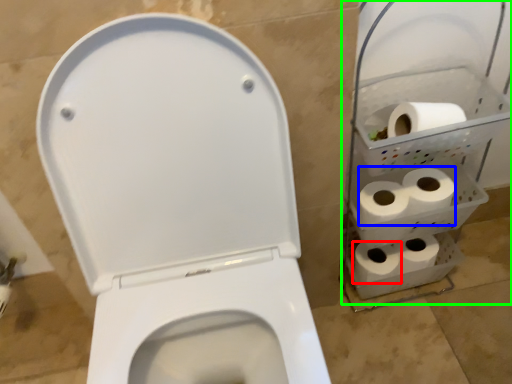
Question: Considering the real-world distances, which object is farthest from toilet paper (highlighted by a red box)? toilet paper (highlighted by a blue box) or shelf (highlighted by a green box)?

Choices:
 (A) toilet paper
 (B) shelf

Answer: (B)